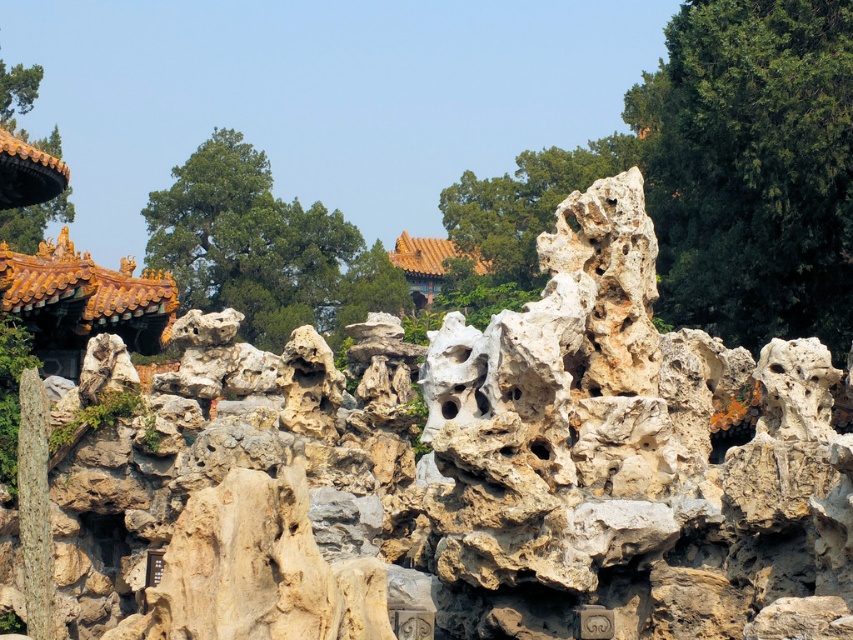
Is point (556, 170) more distant than point (403, 253)?

No, it is not.

Measure the distance from smooth stone rock at center to yellow glazed tile palace at upper center.

17.25 meters

Between point (440, 198) and point (437, 276), which one is positioned behind?

Positioned behind is point (437, 276).

This screenshot has width=853, height=640. Find the location of `smooth stone rock at center`. smooth stone rock at center is located at coordinates (527, 202).

Can you confirm if green leafy tree at center is positioned above smooth stone rock at center?

Incorrect, green leafy tree at center is not positioned above smooth stone rock at center.

Can you confirm if green leafy tree at center is positioned to the left of smooth stone rock at center?

Correct, you'll find green leafy tree at center to the left of smooth stone rock at center.

Who is more distant from viewer, (x=224, y=196) or (x=529, y=177)?

The point (x=224, y=196) is behind.

Locate an element on the screen. The height and width of the screenshot is (640, 853). green leafy tree at center is located at coordinates (263, 250).

Can you confirm if natural stone rock formation at center is shorter than green leafy tree at upper left?

Indeed, natural stone rock formation at center has a lesser height compared to green leafy tree at upper left.

Measure the distance between natural stone rock formation at center and green leafy tree at upper left.

51.21 meters

Is point (161, 612) farther from camera compared to point (18, 84)?

That is False.

The width and height of the screenshot is (853, 640). I want to click on natural stone rock formation at center, so click(x=462, y=474).